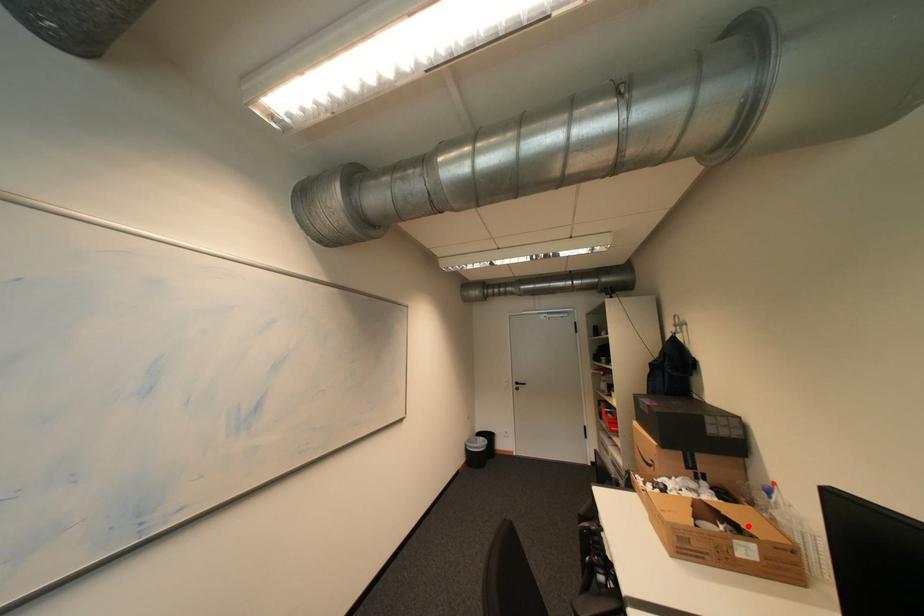
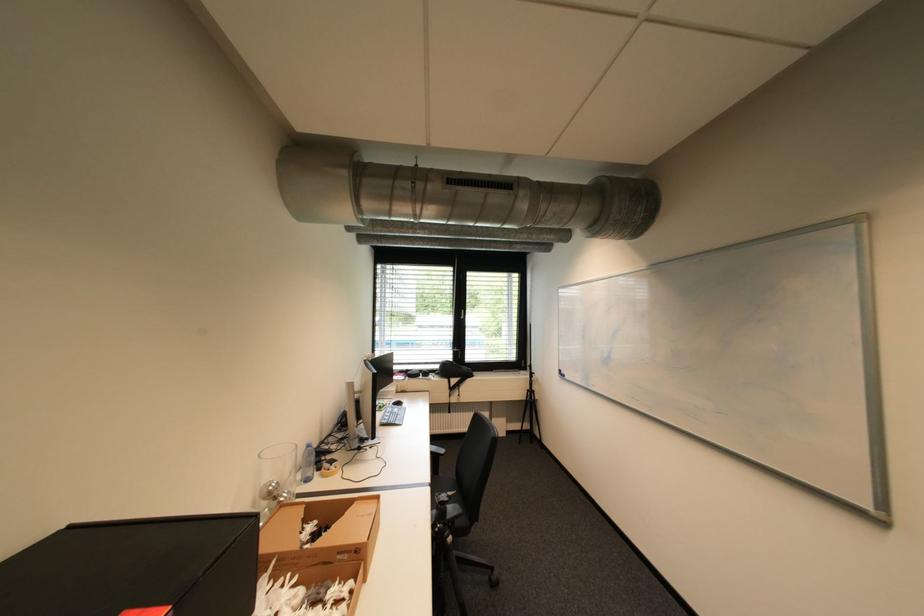
Locate, in the second image, the point that corresponds to the highlighted location in the first image.

(311, 520)